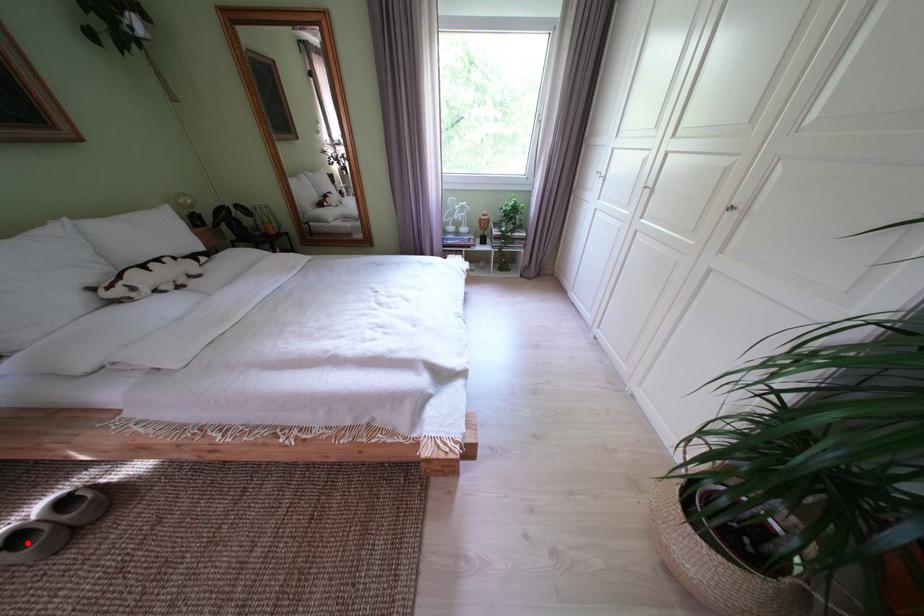
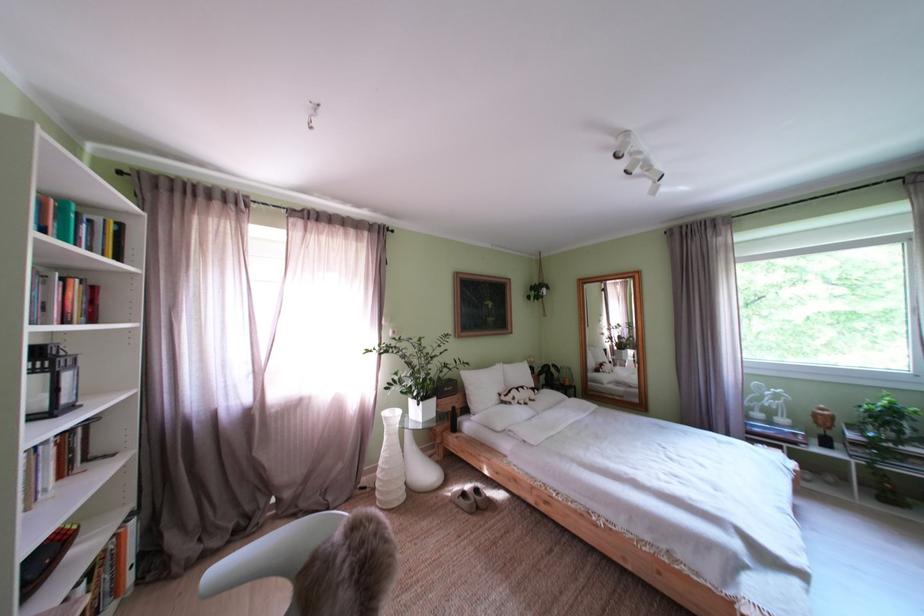
Locate, in the second image, the point that corresponds to the highlighted location in the first image.

(475, 500)